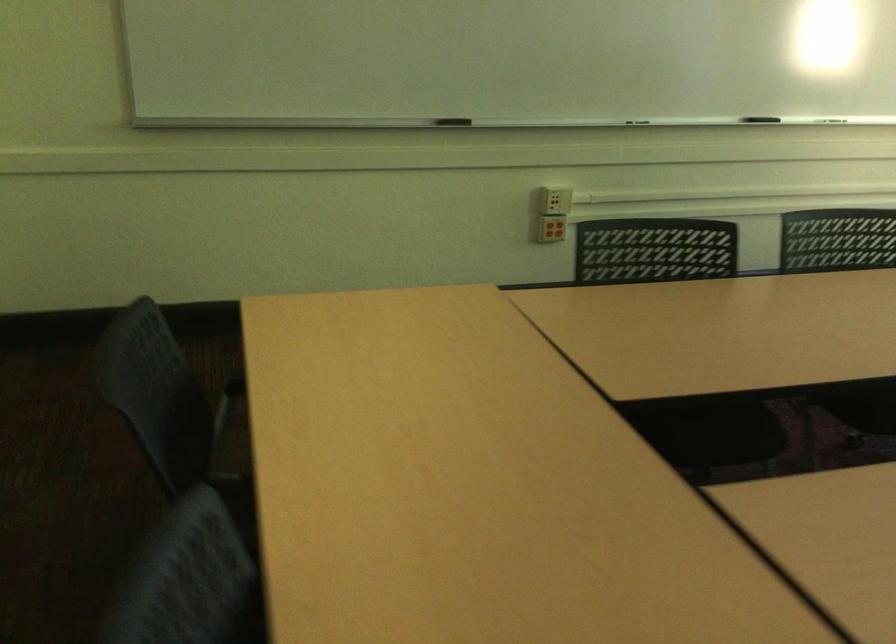
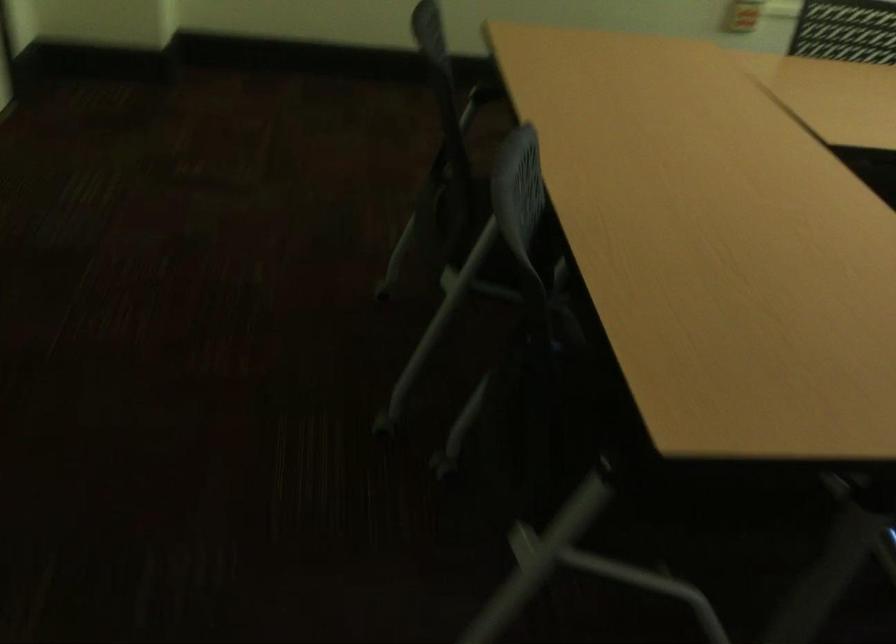
Question: How did the camera likely rotate?

Choices:
 (A) Left
 (B) Right
 (C) Up
 (D) Down

Answer: (D)